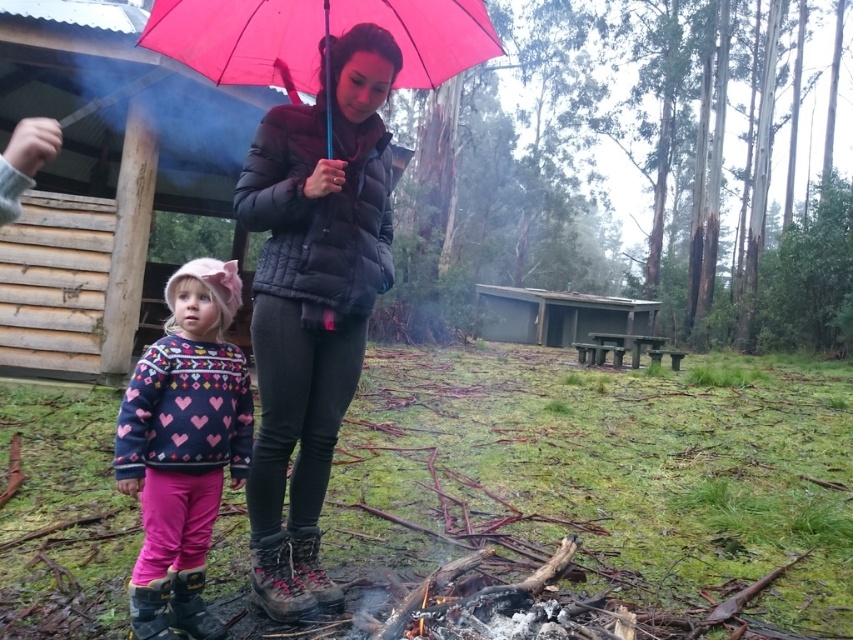
You are planning to take a photo of the two people wearing the matte black puffer jacket at center and the dark blue fleece sweater with hearts at lower left. Which clothing item is bigger in size?

The matte black puffer jacket at center has a larger size compared to the dark blue fleece sweater with hearts at lower left, so the matte black puffer jacket at center is bigger.

You are standing at the point marked by coordinates point (312,301) in the image. What object is located exactly at this point?

The point (312,301) marks the location of the matte black puffer jacket at center.